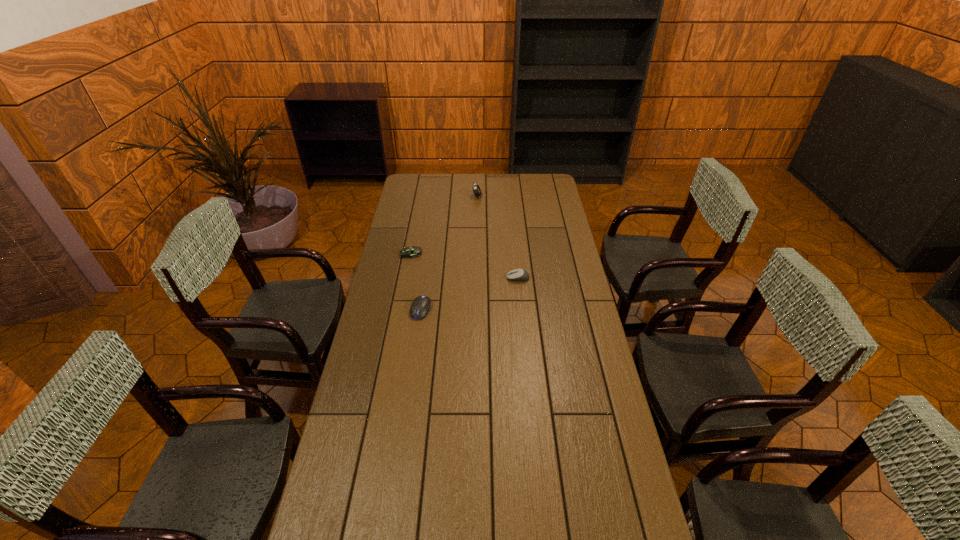
This screenshot has height=540, width=960. In order to click on vacant space located on the wheel side of the rightmost object in this screenshot , I will do `click(422, 278)`.

Where is `vacant region located on the wheel side of the rightmost object`? vacant region located on the wheel side of the rightmost object is located at coordinates (461, 278).

Locate an element on the screen. The image size is (960, 540). free spot located 0.340m on the back of the second farthest object is located at coordinates (420, 208).

Where is `object located at the far edge`? This screenshot has height=540, width=960. object located at the far edge is located at coordinates (476, 189).

At what (x,y) coordinates should I click in order to perform the action: click on vacant space at the far edge of the desktop. Please return your answer as a coordinate pair (x, y). The image size is (960, 540). Looking at the image, I should click on coord(444,175).

Where is `free region at the left edge of the desktop`? The image size is (960, 540). free region at the left edge of the desktop is located at coordinates (412, 275).

Locate an element on the screen. The width and height of the screenshot is (960, 540). free space at the right edge is located at coordinates (587, 417).

Where is `free space between the alarm clock and the second nearest computer mouse`? free space between the alarm clock and the second nearest computer mouse is located at coordinates (497, 238).

Locate an element on the screen. This screenshot has height=540, width=960. free space between the tallest object and the nearest object is located at coordinates (449, 253).

In order to click on vacant space that is in between the second farthest object and the nearest computer mouse in this screenshot , I will do `click(416, 282)`.